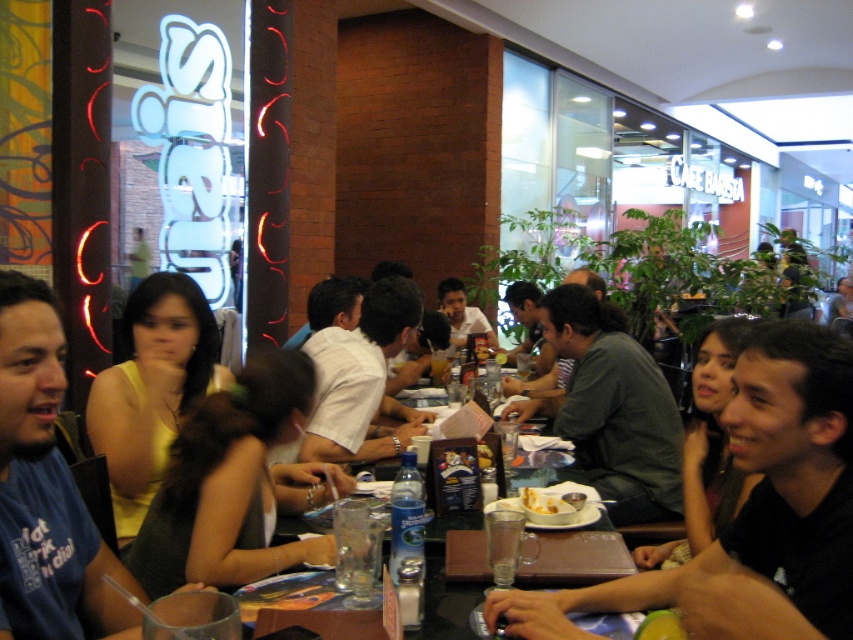
You are a customer at the cafe and want to sit between the dark green fabric dress at center and the yellow fabric shirt at center. Which side should you choose to have enough space for your legs?

The dark green fabric dress at center is wider than the yellow fabric shirt at center, so you should sit on the side of the dark green fabric dress at center to have more space for your legs.